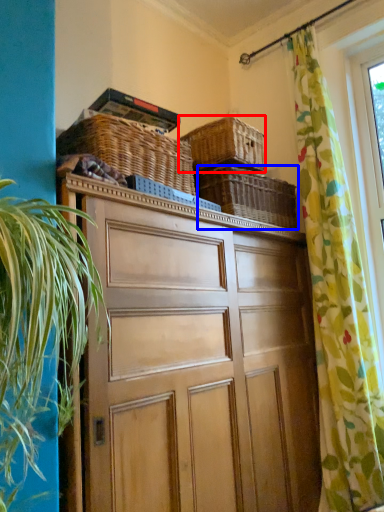
Question: Which object is further to the camera taking this photo, basket (highlighted by a red box) or basket (highlighted by a blue box)?

Choices:
 (A) basket
 (B) basket

Answer: (B)